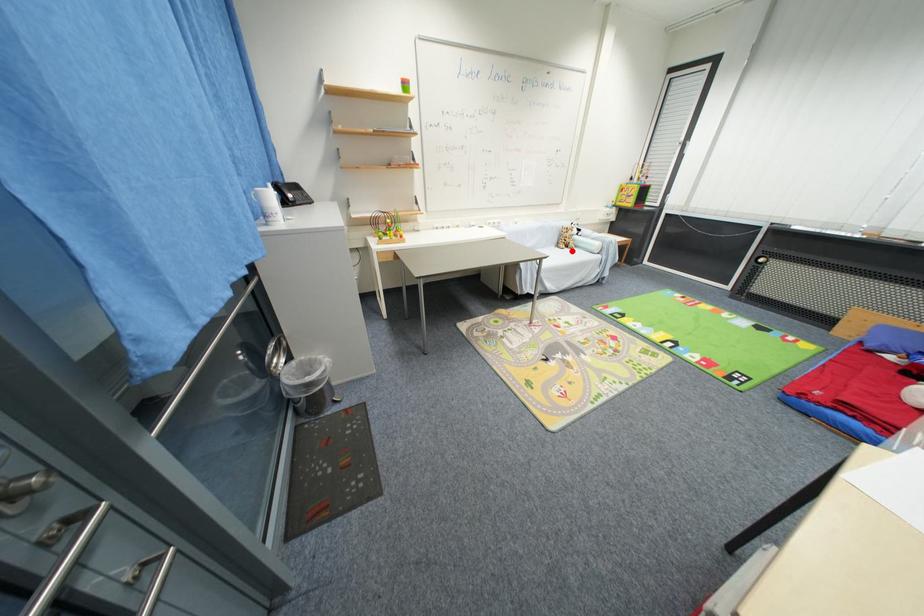
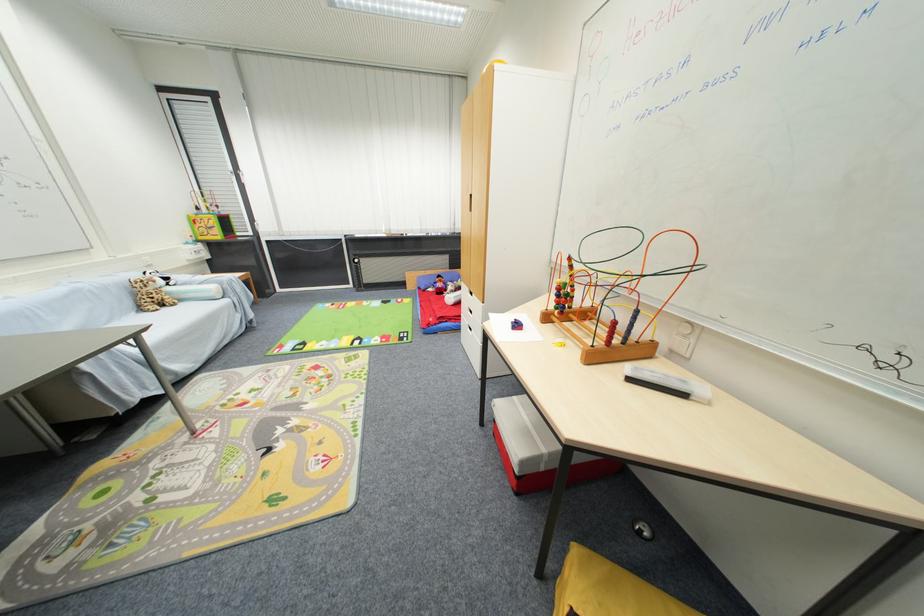
Question: I am providing you with two images of the same scene from different viewpoints. A red point is shown in image1. For the corresponding object point in image2, is it positioned nearer or farther from the camera?

Choices:
 (A) Nearer
 (B) Farther

Answer: (A)